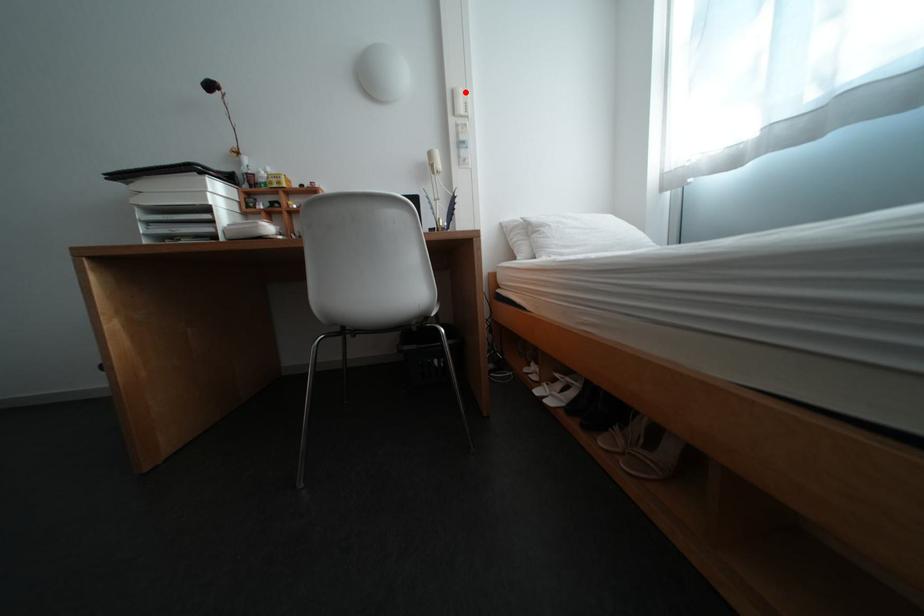
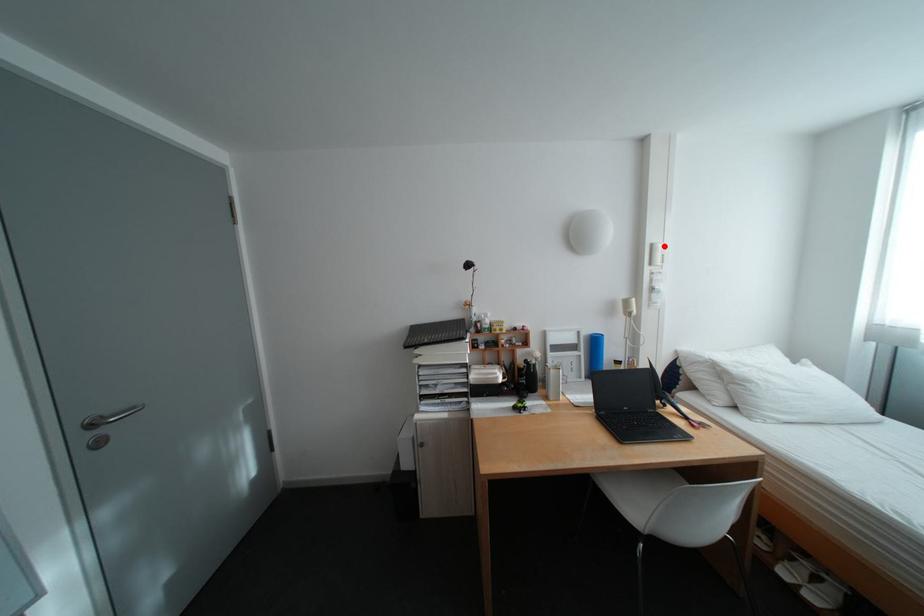
I am providing you with two images of the same scene from different viewpoints. A red point is marked on the first image and another point is marked on the second image. Does the point marked in image1 correspond to the same location as the one in image2?

Yes